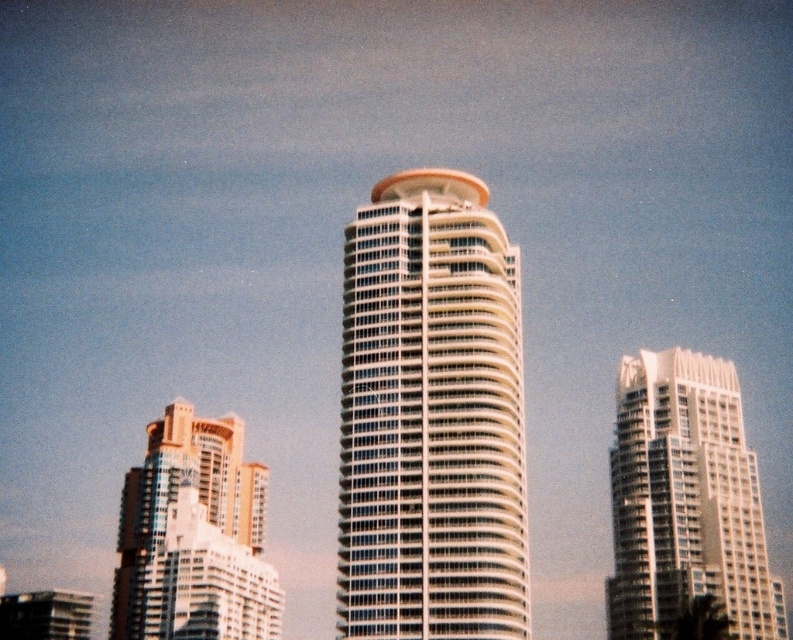
You are standing on the rooftop of the gold metallic building at left and want to get to the observation deck of the white glass building at center. Which direction should you head towards to reach it?

The white glass building at center is in front of the gold metallic building at left, so you should head towards the front direction to reach the observation deck.

In the scene shown: You are standing at the camera position looking at the white glass building at right. If you walk straight towards it for 90 meters, will you reach the building?

The white glass building at right is 93.13 meters from the camera. If you walk straight towards it for 90 meters, you will still be 3.13 meters away from the building, so you won not reach it.

You are a drone operator tasked with flying a drone between the white glass building at center and the gold metallic building at left. The drone has a maximum flight distance of 150 feet. Can the drone safely fly between these two buildings without exceeding its range?

The distance between the white glass building at center and the gold metallic building at left is 165.24 feet. Since the drone has a maximum flight distance of 150 feet, it cannot safely fly between them without exceeding its range.